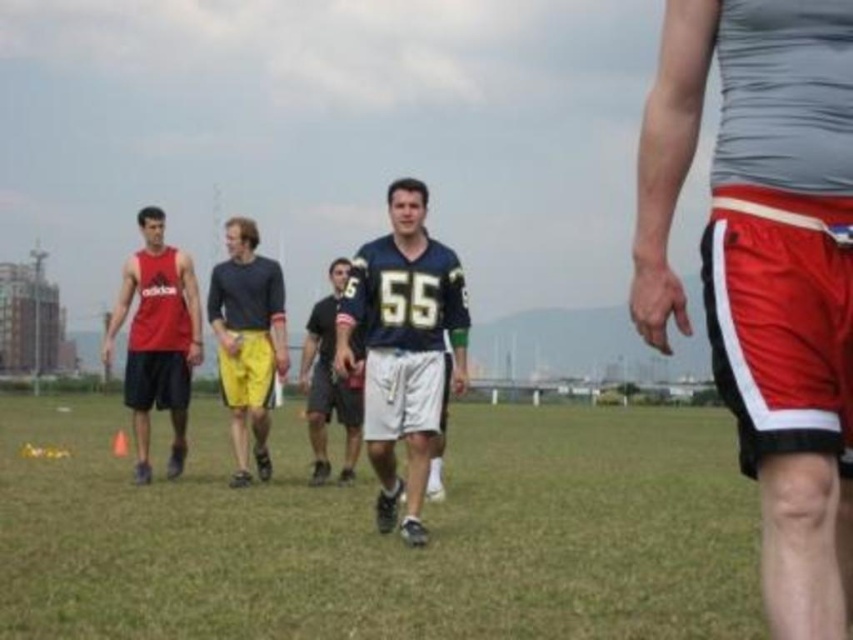
You are standing in the grassy field and see the green grass at center and the dark blue jersey at center. Which object is located to the right side?

The green grass at center is to the right of dark blue jersey at center.

You are standing at the point with coordinates (381, 536). What is the object under your feet?

The object under your feet is green grass at center.